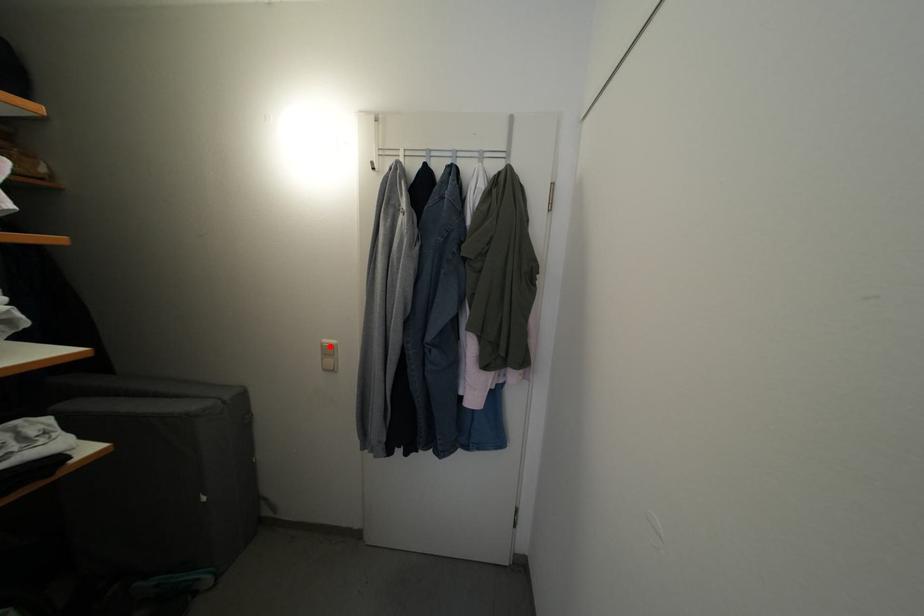
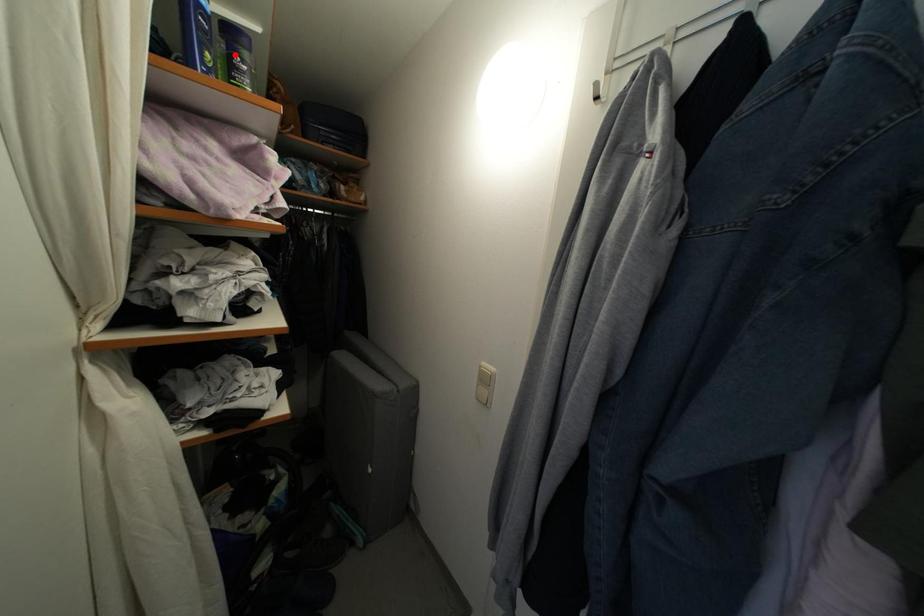
I am providing you with two images of the same scene from different viewpoints. A red point is marked on the first image and another point is marked on the second image. Are the points marked in image1 and image2 representing the same 3D position?

No